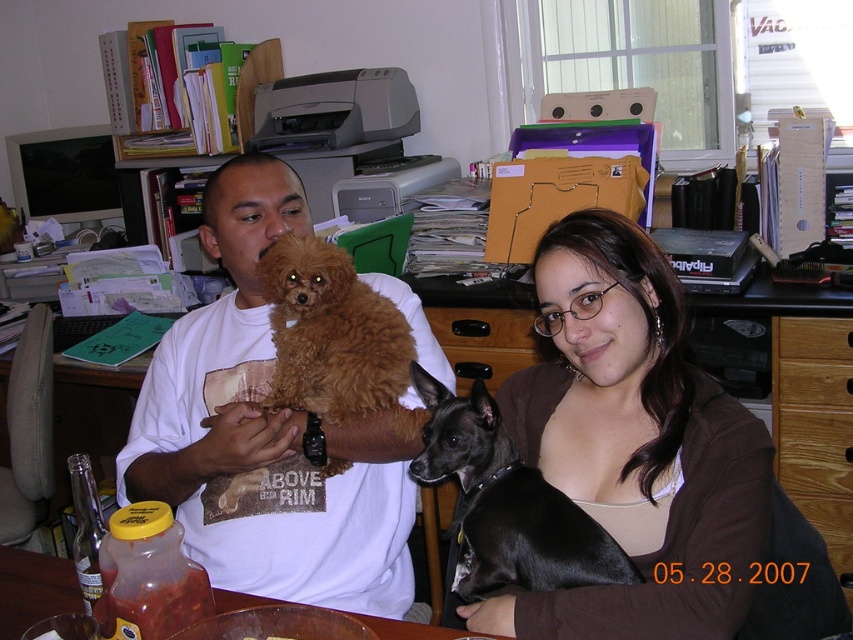
Which is above, matte brown hair at upper center or wooden drawer at center?

wooden drawer at center

Can you confirm if matte brown hair at upper center is shorter than wooden drawer at center?

No, matte brown hair at upper center is not shorter than wooden drawer at center.

Where is `matte brown hair at upper center`? This screenshot has height=640, width=853. matte brown hair at upper center is located at coordinates (631, 445).

How far apart are matte brown hair at upper center and oak wood drawer at center?

matte brown hair at upper center and oak wood drawer at center are 33.22 inches apart.

Does matte brown hair at upper center have a lesser width compared to oak wood drawer at center?

No, matte brown hair at upper center is not thinner than oak wood drawer at center.

Describe the element at coordinates (631, 445) in the screenshot. The width and height of the screenshot is (853, 640). I see `matte brown hair at upper center` at that location.

I want to click on matte brown hair at upper center, so click(x=631, y=445).

Is black smooth dog at center wider than wooden drawer at center?

Indeed, black smooth dog at center has a greater width compared to wooden drawer at center.

Is the position of black smooth dog at center less distant than that of wooden drawer at center?

Yes.

In order to click on black smooth dog at center in this screenshot , I will do `click(506, 504)`.